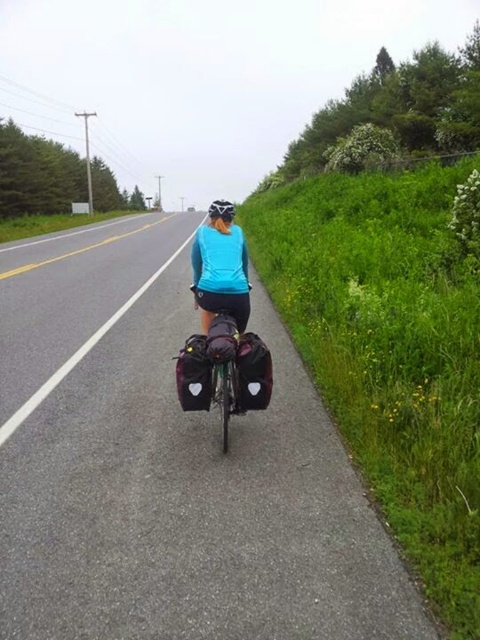
Who is positioned more to the left, asphalt road at center or blue matte jacket at center?

asphalt road at center

Where is `asphalt road at center`? This screenshot has height=640, width=480. asphalt road at center is located at coordinates (168, 467).

What do you see at coordinates (168, 467) in the screenshot? I see `asphalt road at center` at bounding box center [168, 467].

The image size is (480, 640). What are the coordinates of `asphalt road at center` in the screenshot? It's located at (168, 467).

Does asphalt road at center have a greater width compared to black matte bicycle helmet at upper center?

Yes.

Can you confirm if asphalt road at center is bigger than black matte bicycle helmet at upper center?

Yes.

Identify the location of asphalt road at center. (168, 467).

Is blue matte jacket at center to the right of black matte bicycle helmet at upper center from the viewer's perspective?

In fact, blue matte jacket at center is to the left of black matte bicycle helmet at upper center.

Does point (244, 276) come farther from viewer compared to point (210, 218)?

No, it is in front of (210, 218).

Which is in front, point (239, 266) or point (223, 218)?

Positioned in front is point (239, 266).

This screenshot has height=640, width=480. Identify the location of blue matte jacket at center. point(220,266).